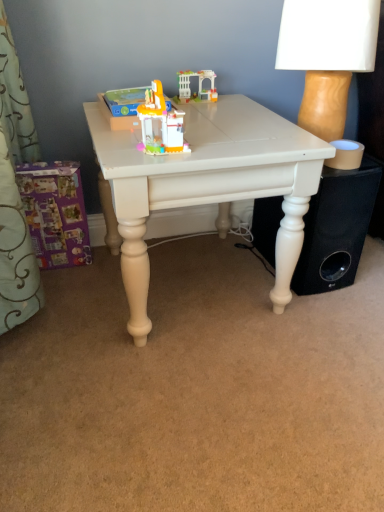
The width and height of the screenshot is (384, 512). What do you see at coordinates (55, 213) in the screenshot?
I see `purple cardboard box at lower left, which is the fourth toy from top to bottom` at bounding box center [55, 213].

How much space does purple cardboard box at lower left, which is the fourth toy from top to bottom, occupy horizontally?

2.34 inches.

Describe the element at coordinates (198, 85) in the screenshot. Image resolution: width=384 pixels, height=512 pixels. I see `white plastic arch at center, the fourth toy in the bottom-to-top sequence` at that location.

What is the approximate height of wooden table lamp at upper right?

wooden table lamp at upper right is 37.39 centimeters in height.

The width and height of the screenshot is (384, 512). What do you see at coordinates (327, 56) in the screenshot? I see `wooden table lamp at upper right` at bounding box center [327, 56].

Describe the element at coordinates (125, 100) in the screenshot. I see `translucent plastic toy at center, marked as the second toy in a left-to-right arrangement` at that location.

Describe the element at coordinates (207, 184) in the screenshot. I see `white painted wood table at center` at that location.

You are a GUI agent. You are given a task and a screenshot of the screen. Output one action in this format:
    pyautogui.click(x=<x>, y=<y>)
    Task: Click on the purple cardboard box at lower left, marked as the fourth toy in a right-to-left arrangement
    The height and width of the screenshot is (512, 384).
    Given the screenshot: What is the action you would take?
    pyautogui.click(x=55, y=213)

Which object is wider, translucent plastic toy at center, which is counted as the 4th toy, starting from the back, or purple cardboard box at lower left, marked as the fourth toy in a right-to-left arrangement?

Wider between the two is translucent plastic toy at center, which is counted as the 4th toy, starting from the back.

Is there a large distance between translucent plastic toy at center, which ranks as the third toy in top-to-bottom order, and purple cardboard box at lower left, acting as the 2th toy starting from the back?

No, translucent plastic toy at center, which ranks as the third toy in top-to-bottom order, is in close proximity to purple cardboard box at lower left, acting as the 2th toy starting from the back.

Where is `the 3rd toy directly above the purple cardboard box at lower left, arranged as the first toy when viewed from the left (from a real-world perspective)`? the 3rd toy directly above the purple cardboard box at lower left, arranged as the first toy when viewed from the left (from a real-world perspective) is located at coordinates (160, 123).

Does translucent plastic toy at center, which is counted as the 4th toy, starting from the back, lie in front of purple cardboard box at lower left, the 3th toy positioned from the front?

Yes, the depth of translucent plastic toy at center, which is counted as the 4th toy, starting from the back, is less than that of purple cardboard box at lower left, the 3th toy positioned from the front.

Between purple cardboard box at lower left, the 1th toy positioned from the bottom, and white painted wood table at center, which one has smaller size?

purple cardboard box at lower left, the 1th toy positioned from the bottom.

Can you confirm if purple cardboard box at lower left, which is the fourth toy from top to bottom, is positioned to the left of white painted wood table at center?

Yes.

Between purple cardboard box at lower left, the 1th toy positioned from the bottom, and white painted wood table at center, which one has larger width?

white painted wood table at center.

From a real-world perspective, is purple cardboard box at lower left, which is the fourth toy from top to bottom, positioned under white painted wood table at center based on gravity?

Yes.

Can you see wooden table lamp at upper right touching white plastic arch at center, positioned as the 4th toy in front-to-back order?

wooden table lamp at upper right and white plastic arch at center, positioned as the 4th toy in front-to-back order, are not in contact.

Is wooden table lamp at upper right to the left of white plastic arch at center, positioned as the 4th toy in front-to-back order, from the viewer's perspective?

No, wooden table lamp at upper right is not to the left of white plastic arch at center, positioned as the 4th toy in front-to-back order.

Is wooden table lamp at upper right wider than white plastic arch at center, acting as the first toy starting from the top?

Yes, wooden table lamp at upper right is wider than white plastic arch at center, acting as the first toy starting from the top.

The width and height of the screenshot is (384, 512). What are the coordinates of `toy that appears above the wooden table lamp at upper right (from the image's perspective)` in the screenshot? It's located at (198, 85).

Which is behind, point (139, 104) or point (146, 116)?

Point (139, 104)

Looking at this image, considering the relative sizes of translucent plastic toy at center, arranged as the 3th toy when ordered from the bottom, and translucent plastic toy at center, which is counted as the 4th toy, starting from the back, in the image provided, is translucent plastic toy at center, arranged as the 3th toy when ordered from the bottom, shorter than translucent plastic toy at center, which is counted as the 4th toy, starting from the back,?

Yes.

At what (x,y) coordinates should I click in order to perform the action: click on the 1st toy to the left when counting from the translucent plastic toy at center, which is the second toy from bottom to top. Please return your answer as a coordinate pair (x, y). The height and width of the screenshot is (512, 384). Looking at the image, I should click on (125, 100).

From a real-world perspective, which object stands above the other?

In real-world perspective, translucent plastic toy at center, the 1th toy in the front-to-back sequence, is above.

Is translucent plastic toy at center, which is counted as the 4th toy, starting from the back, wider than white painted wood table at center?

Incorrect, the width of translucent plastic toy at center, which is counted as the 4th toy, starting from the back, does not surpass that of white painted wood table at center.

Consider the image. Is translucent plastic toy at center, which is the second toy from bottom to top, not within white painted wood table at center?

Yes, translucent plastic toy at center, which is the second toy from bottom to top, is outside of white painted wood table at center.

Identify the location of toy in front of the white painted wood table at center. This screenshot has width=384, height=512. (160, 123).

Which object is positioned more to the right, translucent plastic toy at center, which appears as the third toy when viewed from the left, or white painted wood table at center?

From the viewer's perspective, white painted wood table at center appears more on the right side.

Does wooden table lamp at upper right turn towards white painted wood table at center?

No.

From a real-world perspective, is wooden table lamp at upper right positioned over white painted wood table at center based on gravity?

Yes, from a real-world perspective, wooden table lamp at upper right is on top of white painted wood table at center.

Does wooden table lamp at upper right have a greater height compared to white painted wood table at center?

In fact, wooden table lamp at upper right may be shorter than white painted wood table at center.

Is the depth of wooden table lamp at upper right greater than that of white painted wood table at center?

That is True.

The image size is (384, 512). Identify the location of table located below the translucent plastic toy at center, which ranks as the third toy in top-to-bottom order (from the image's perspective). (207, 184).

From the image's perspective, which is below, white painted wood table at center or translucent plastic toy at center, which appears as the third toy when viewed from the left?

white painted wood table at center.

Can you confirm if white painted wood table at center is wider than translucent plastic toy at center, which is counted as the 4th toy, starting from the back?

Correct, the width of white painted wood table at center exceeds that of translucent plastic toy at center, which is counted as the 4th toy, starting from the back.

The height and width of the screenshot is (512, 384). What are the coordinates of `toy that is the 2nd one when counting forward from the purple cardboard box at lower left, which is the fourth toy from top to bottom` in the screenshot? It's located at (x=160, y=123).

Find the location of a particular element. This screenshot has height=512, width=384. toy that appears below the white painted wood table at center (from a real-world perspective) is located at coordinates (55, 213).

From the image, which object appears to be farther from white painted wood table at center, purple cardboard box at lower left, arranged as the first toy when viewed from the left, or translucent plastic toy at center, which ranks as the third toy in top-to-bottom order?

purple cardboard box at lower left, arranged as the first toy when viewed from the left, lies further to white painted wood table at center than the other object.

Looking at the image, which one is located closer to white painted wood table at center, white plastic arch at center, the fourth toy in the bottom-to-top sequence, or black matte speaker at lower right?

The object closer to white painted wood table at center is black matte speaker at lower right.

Based on their spatial positions, is black matte speaker at lower right or translucent plastic toy at center, the 2th toy when ordered from top to bottom, closer to purple cardboard box at lower left, marked as the fourth toy in a right-to-left arrangement?

translucent plastic toy at center, the 2th toy when ordered from top to bottom, lies closer to purple cardboard box at lower left, marked as the fourth toy in a right-to-left arrangement, than the other object.

Based on their spatial positions, is white painted wood table at center or white plastic arch at center, positioned as the 1th toy in right-to-left order, closer to translucent plastic toy at center, which is the 2th toy from right to left?

white painted wood table at center lies closer to translucent plastic toy at center, which is the 2th toy from right to left, than the other object.

Which object lies nearer to the anchor point translucent plastic toy at center, arranged as the 3th toy when ordered from the bottom, black matte speaker at lower right or purple cardboard box at lower left, which is the fourth toy from top to bottom?

The object closer to translucent plastic toy at center, arranged as the 3th toy when ordered from the bottom, is purple cardboard box at lower left, which is the fourth toy from top to bottom.

From the image, which object appears to be nearer to black matte speaker at lower right, translucent plastic toy at center, which is the second toy from bottom to top, or purple cardboard box at lower left, the 3th toy positioned from the front?

translucent plastic toy at center, which is the second toy from bottom to top, is positioned closer to the anchor black matte speaker at lower right.

When comparing their distances from white plastic arch at center, positioned as the 4th toy in front-to-back order, does purple cardboard box at lower left, the 3th toy positioned from the front, or black matte speaker at lower right seem further?

black matte speaker at lower right lies further to white plastic arch at center, positioned as the 4th toy in front-to-back order, than the other object.

Which object lies nearer to the anchor point purple cardboard box at lower left, arranged as the first toy when viewed from the left, translucent plastic toy at center, which is the second toy from bottom to top, or translucent plastic toy at center, arranged as the 3th toy when ordered from the bottom?

translucent plastic toy at center, arranged as the 3th toy when ordered from the bottom.

You are a GUI agent. You are given a task and a screenshot of the screen. Output one action in this format:
    pyautogui.click(x=<x>, y=<y>)
    Task: Click on the table situated between purple cardboard box at lower left, the 1th toy positioned from the bottom, and white plastic arch at center, the fourth toy from the left, from left to right
    
    Given the screenshot: What is the action you would take?
    pyautogui.click(x=207, y=184)

I want to click on toy between translucent plastic toy at center, which appears as the third toy when viewed from the left, and wooden table lamp at upper right, in the horizontal direction, so click(x=198, y=85).

You are a GUI agent. You are given a task and a screenshot of the screen. Output one action in this format:
    pyautogui.click(x=<x>, y=<y>)
    Task: Click on the table that lies between white plastic arch at center, the fourth toy from the left, and black matte speaker at lower right from top to bottom
    The width and height of the screenshot is (384, 512).
    Given the screenshot: What is the action you would take?
    pyautogui.click(x=207, y=184)

Identify the location of table lamp between purple cardboard box at lower left, marked as the fourth toy in a right-to-left arrangement, and black matte speaker at lower right, in the horizontal direction. This screenshot has width=384, height=512. (327, 56).